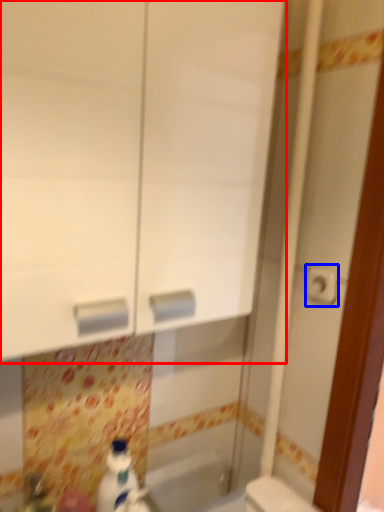
Question: Which object appears closest to the camera in this image, medicine cabinet (highlighted by a red box) or toilet paper (highlighted by a blue box)?

Choices:
 (A) medicine cabinet
 (B) toilet paper

Answer: (A)